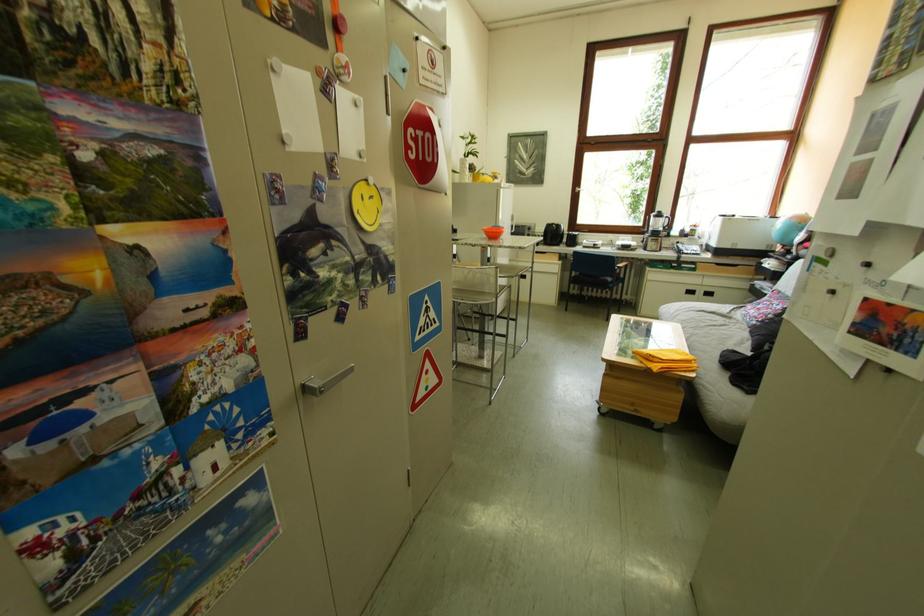
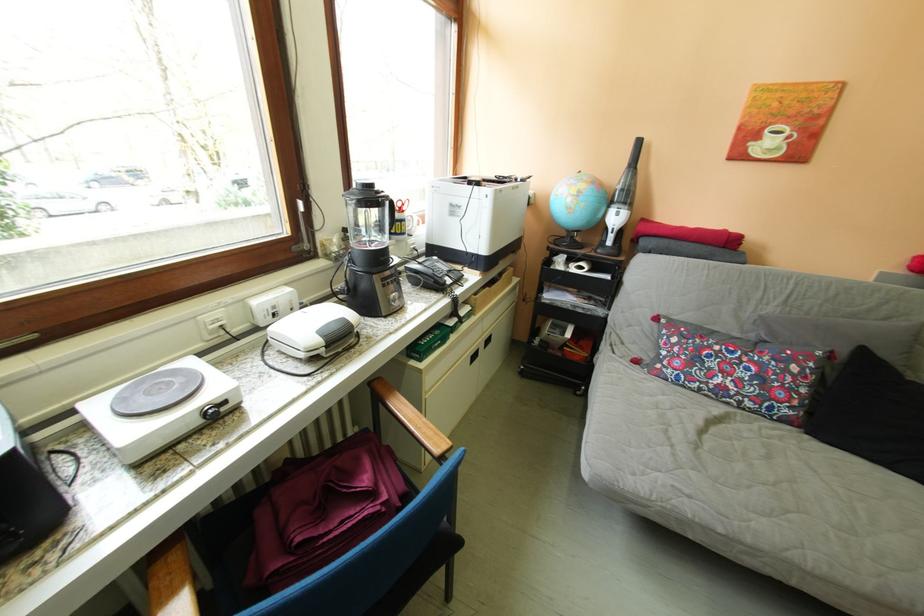
Find the pixel in the second image that matches pixel 611 248 in the first image.

(237, 406)